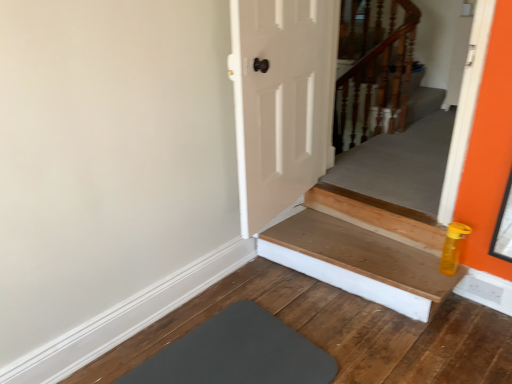
Find the location of a particular element. free space on the front side of wooden at bottom is located at coordinates (367, 347).